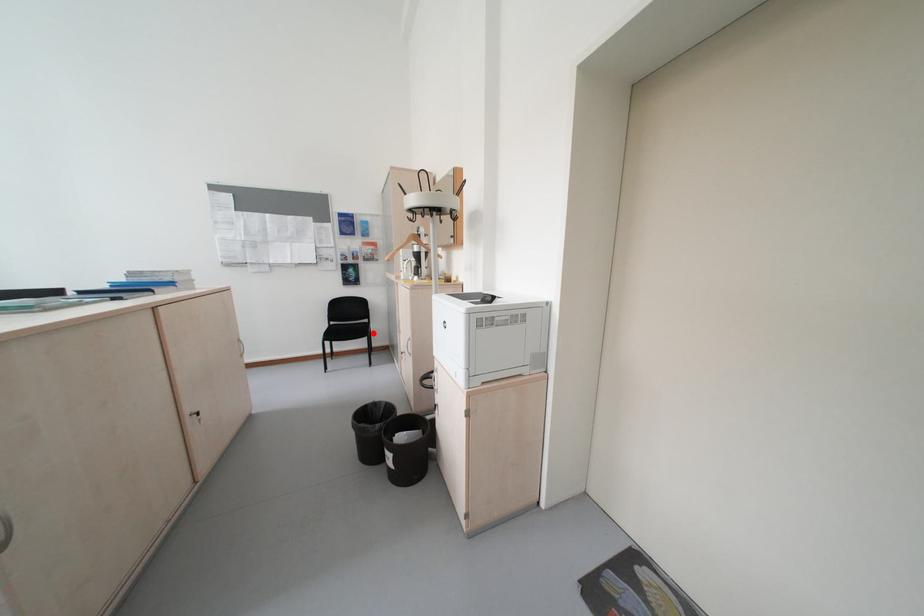
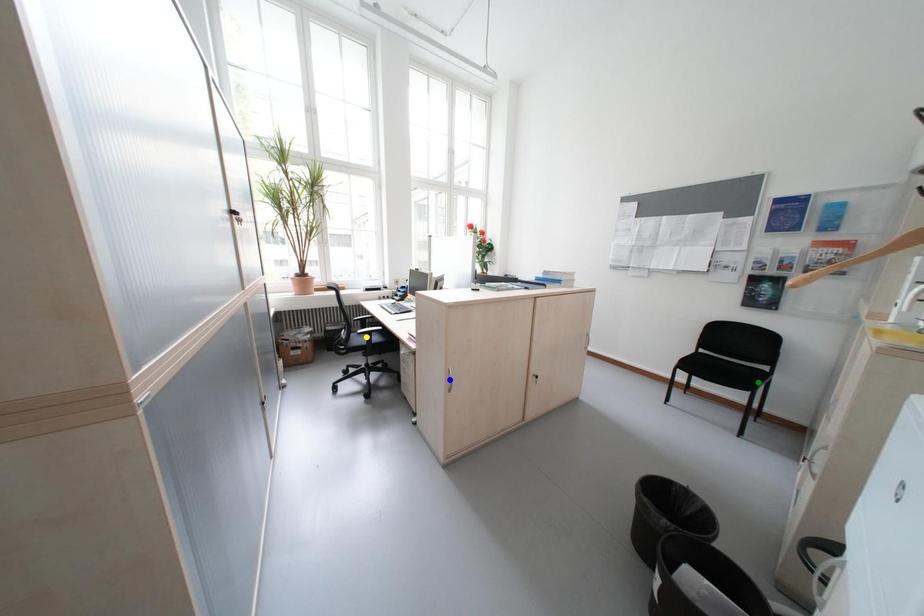
Question: I am providing you with two images of the same scene from different viewpoints. A red point is marked on the first image. You are given multiple points on the second image. Which spot in image 2 lines up with the point in image 1?

Choices:
 (A) yellow point
 (B) green point
 (C) blue point

Answer: (B)